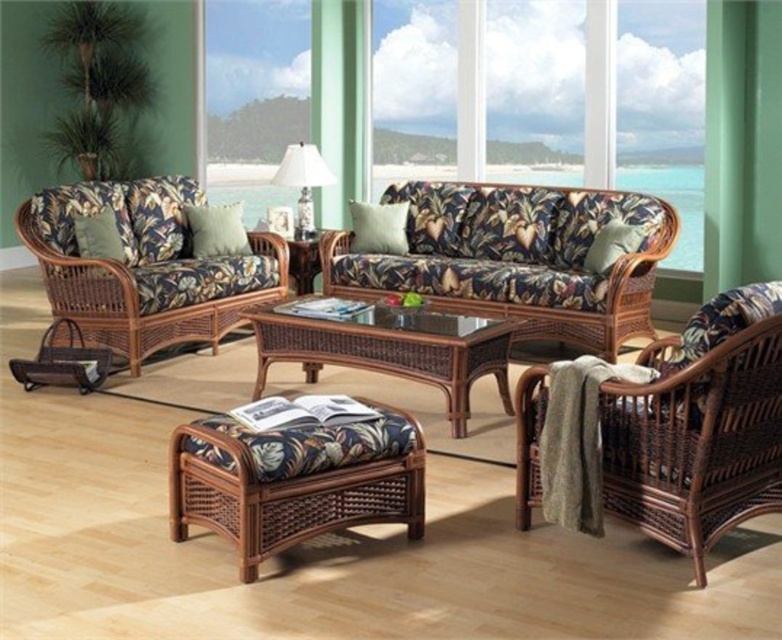
Question: Is brown wicker coffee table at center to the left of white fabric pillow at center from the viewer's perspective?

Choices:
 (A) no
 (B) yes

Answer: (A)

Question: Is matte wicker stool at center to the right of beige fabric pillow at center from the viewer's perspective?

Choices:
 (A) no
 (B) yes

Answer: (B)

Question: Which of the following is the farthest from the observer?

Choices:
 (A) (364, 248)
 (B) (277, 145)
 (C) (228, 209)

Answer: (B)

Question: Which of the following is the farthest from the observer?

Choices:
 (A) (303, 156)
 (B) (316, 365)
 (C) (673, 17)
 (D) (97, 250)

Answer: (A)

Question: From the image, what is the correct spatial relationship of beige fabric pillow at center in relation to green floral cushion at left?

Choices:
 (A) right
 (B) left

Answer: (A)

Question: Based on their relative distances, which object is farther from the green floral cushion at left?

Choices:
 (A) white fabric pillow at center
 (B) white glossy table lamp at center
 (C) matte wicker couch at upper center
 (D) brown wicker coffee table at center

Answer: (C)